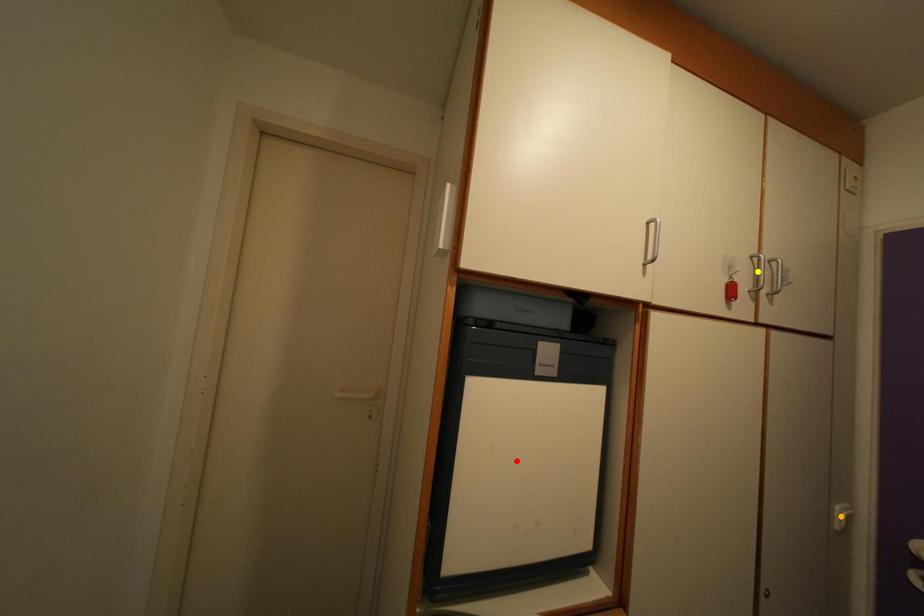
Order these from nearest to farthest:
yellow point
red point
orange point

orange point → red point → yellow point